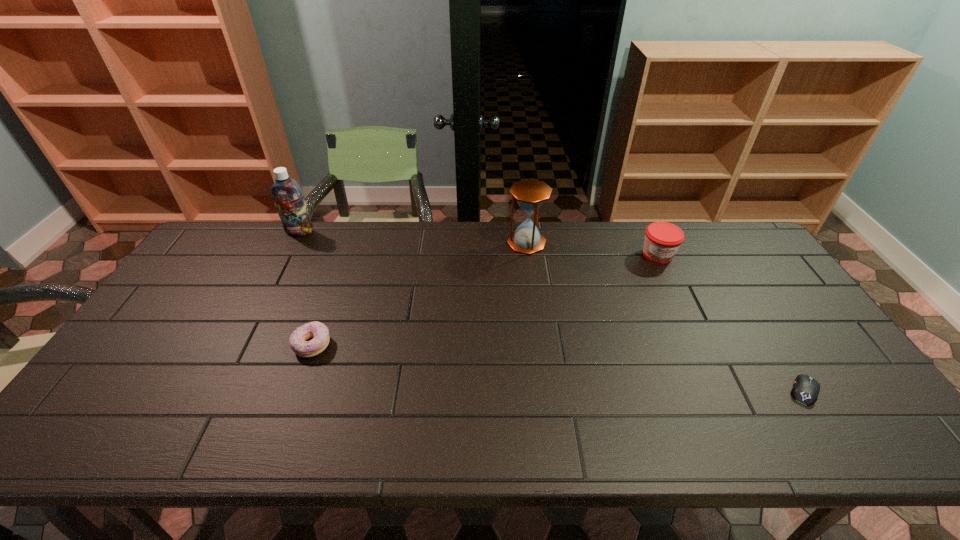
Find the location of a particular element. vacant space located on the front of the third object from left to right is located at coordinates (536, 315).

The image size is (960, 540). Identify the location of free space located 0.360m on the label side of the jam. (706, 357).

You are a GUI agent. You are given a task and a screenshot of the screen. Output one action in this format:
    pyautogui.click(x=<x>, y=<y>)
    Task: Click on the blank area located 0.380m on the left of the fourth tallest object
    
    Given the screenshot: What is the action you would take?
    pyautogui.click(x=151, y=346)

Locate an element on the screen. This screenshot has height=540, width=960. free spot located on the left of the computer equipment is located at coordinates (623, 390).

This screenshot has height=540, width=960. Identify the location of shampoo positioned at the far edge. (288, 197).

The height and width of the screenshot is (540, 960). Identify the location of hourglass that is at the far edge. (530, 194).

Image resolution: width=960 pixels, height=540 pixels. Identify the location of jam at the far edge. (662, 239).

Locate an element on the screen. object that is positioned at the right edge is located at coordinates (806, 389).

The width and height of the screenshot is (960, 540). Identify the location of vacant region at the far edge of the desktop. (576, 248).

Find the location of `free space at the near edge`. free space at the near edge is located at coordinates (191, 442).